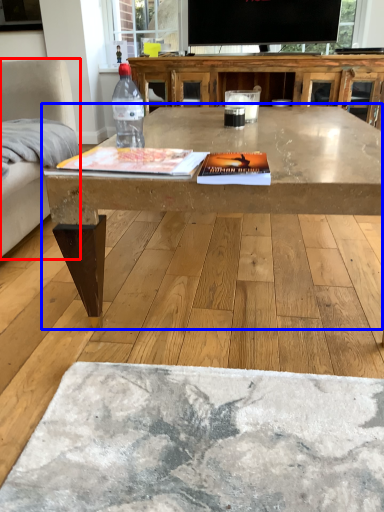
Question: Among these objects, which one is nearest to the camera, armchair (highlighted by a red box) or coffee table (highlighted by a blue box)?

Choices:
 (A) armchair
 (B) coffee table

Answer: (B)